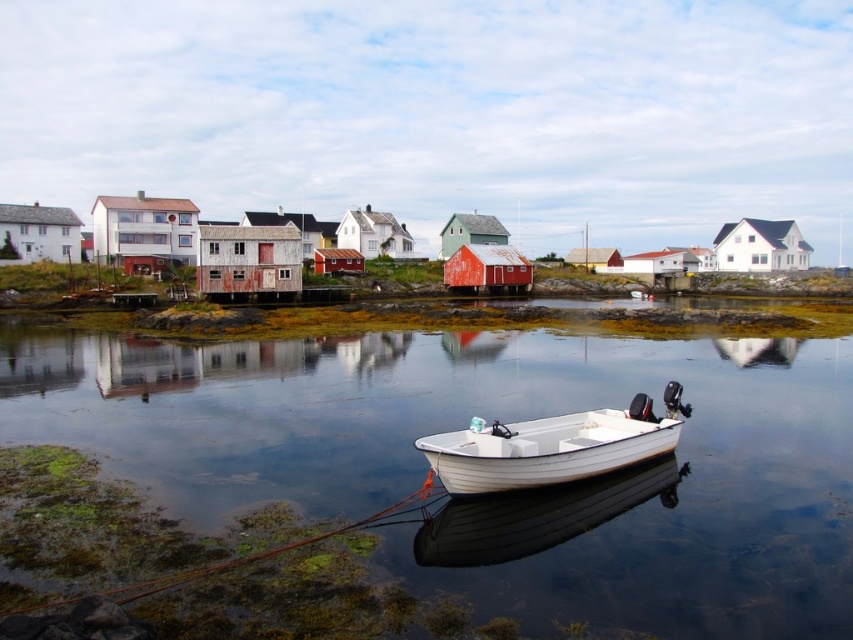
Question: Where is clear water at center located in relation to white wood boat at center in the image?

Choices:
 (A) below
 (B) above

Answer: (B)

Question: Is clear water at center thinner than white wood boat at center?

Choices:
 (A) no
 (B) yes

Answer: (A)

Question: Does clear water at center have a larger size compared to white wood boat at center?

Choices:
 (A) yes
 (B) no

Answer: (A)

Question: Which object is farther from the camera taking this photo?

Choices:
 (A) white wood boat at center
 (B) clear water at center

Answer: (A)